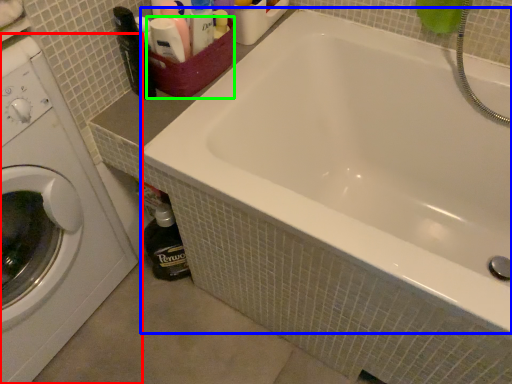
Question: Estimate the real-world distances between objects in this image. Which object is farther from washing machine (highlighted by a red box), bathtub (highlighted by a blue box) or basket (highlighted by a green box)?

Choices:
 (A) bathtub
 (B) basket

Answer: (A)